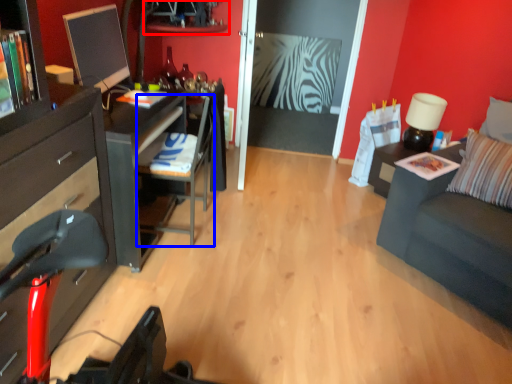
Question: Which object appears farthest to the camera in this image, shelf (highlighted by a red box) or armchair (highlighted by a blue box)?

Choices:
 (A) shelf
 (B) armchair

Answer: (A)